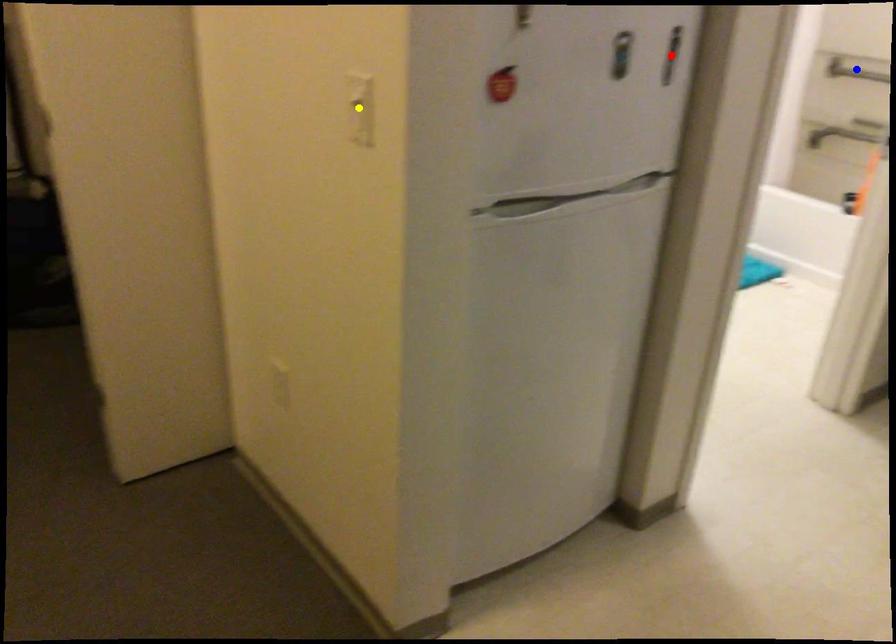
Order these from nearest to farthest:
blue point | red point | yellow point

yellow point, red point, blue point